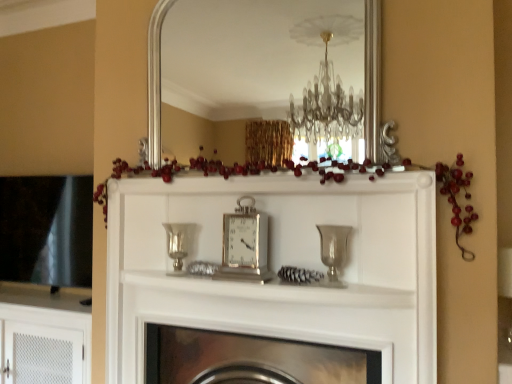
Question: Is silver/metallic clock at center looking in the opposite direction of silver metallic vase at center, which is the second candle holder in right-to-left order?

Choices:
 (A) no
 (B) yes

Answer: (A)

Question: Is silver/metallic clock at center completely or partially outside of silver metallic vase at center, arranged as the 1th candle holder when viewed from the left?

Choices:
 (A) no
 (B) yes

Answer: (B)

Question: Does silver/metallic clock at center have a larger size compared to silver metallic vase at center, which is the second candle holder in right-to-left order?

Choices:
 (A) yes
 (B) no

Answer: (A)

Question: Is silver/metallic clock at center placed right next to silver metallic vase at center, the 1th candle holder from the back?

Choices:
 (A) no
 (B) yes

Answer: (A)

Question: Is silver/metallic clock at center oriented towards silver metallic vase at center, which is counted as the 2th candle holder, starting from the front?

Choices:
 (A) yes
 (B) no

Answer: (B)

Question: Is silver/metallic clock at center wider than silver metallic vase at center, the 1th candle holder from the back?

Choices:
 (A) yes
 (B) no

Answer: (B)

Question: From the image's perspective, is white textured cabinet at lower left located above silver/metallic clock at center?

Choices:
 (A) no
 (B) yes

Answer: (A)

Question: From a real-world perspective, is white textured cabinet at lower left below silver/metallic clock at center?

Choices:
 (A) no
 (B) yes

Answer: (B)

Question: Is there a large distance between white textured cabinet at lower left and silver/metallic clock at center?

Choices:
 (A) yes
 (B) no

Answer: (A)

Question: Is white textured cabinet at lower left positioned behind silver/metallic clock at center?

Choices:
 (A) no
 (B) yes

Answer: (B)

Question: Considering the relative sizes of white textured cabinet at lower left and silver/metallic clock at center in the image provided, is white textured cabinet at lower left bigger than silver/metallic clock at center?

Choices:
 (A) yes
 (B) no

Answer: (A)

Question: Is white textured cabinet at lower left oriented away from silver/metallic clock at center?

Choices:
 (A) no
 (B) yes

Answer: (A)

Question: Can you confirm if white textured cabinet at lower left is thinner than silver/metallic mirror at upper center?

Choices:
 (A) yes
 (B) no

Answer: (B)